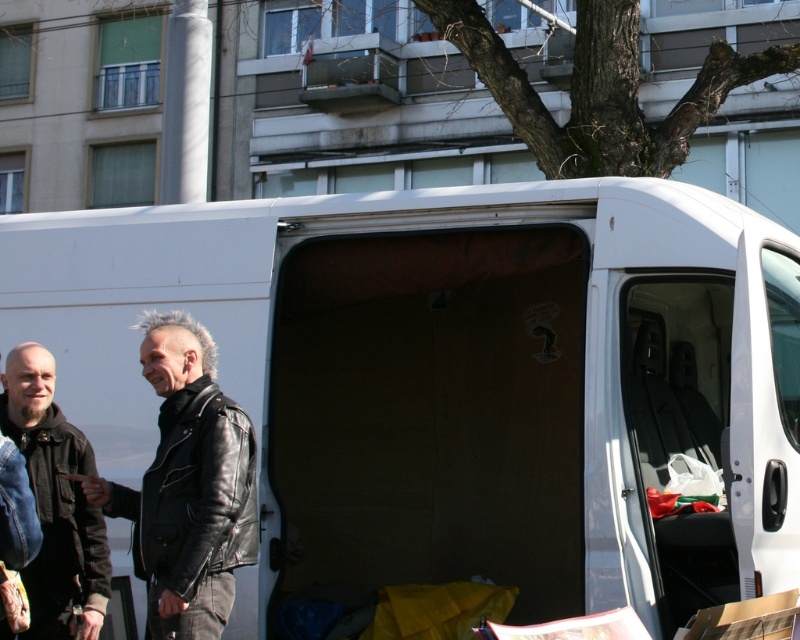
Question: Is white matte van at center wider than leather jacket at left?

Choices:
 (A) yes
 (B) no

Answer: (A)

Question: Which of the following is the farthest from the observer?

Choices:
 (A) (666, 589)
 (B) (14, 570)
 (C) (158, 564)

Answer: (A)

Question: Does black leather jacket at center come in front of matte black leather jacket at left?

Choices:
 (A) no
 (B) yes

Answer: (B)

Question: Can you confirm if matte black leather jacket at left is smaller than leather jacket at left?

Choices:
 (A) yes
 (B) no

Answer: (B)

Question: Which point is farther to the camera?

Choices:
 (A) leather jacket at left
 (B) black leather jacket at center

Answer: (A)

Question: Which point is closer to the camera taking this photo?

Choices:
 (A) (70, 557)
 (B) (244, 428)
 (C) (394, 547)

Answer: (B)